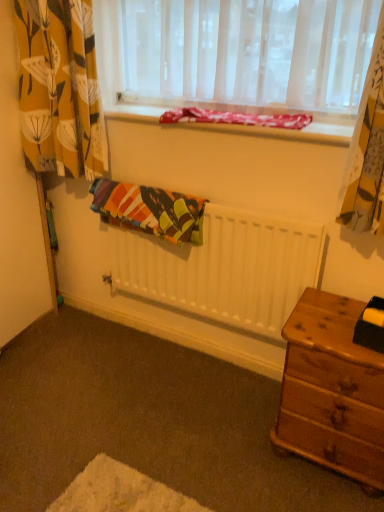
Question: Is wooden nightstand at lower right looking in the opposite direction of white matte radiator at center?

Choices:
 (A) yes
 (B) no

Answer: (B)

Question: Does wooden nightstand at lower right appear on the right side of white matte radiator at center?

Choices:
 (A) no
 (B) yes

Answer: (B)

Question: Is wooden nightstand at lower right smaller than white matte radiator at center?

Choices:
 (A) yes
 (B) no

Answer: (B)

Question: Is the depth of wooden nightstand at lower right less than that of white matte radiator at center?

Choices:
 (A) no
 (B) yes

Answer: (B)

Question: Is white matte radiator at center inside wooden nightstand at lower right?

Choices:
 (A) no
 (B) yes

Answer: (A)

Question: Are wooden nightstand at lower right and white matte radiator at center far apart?

Choices:
 (A) no
 (B) yes

Answer: (A)

Question: From a real-world perspective, is white matte radiator at center on top of wooden nightstand at lower right?

Choices:
 (A) yes
 (B) no

Answer: (A)

Question: Can wooden nightstand at lower right be found inside white matte radiator at center?

Choices:
 (A) no
 (B) yes

Answer: (A)

Question: Is white matte radiator at center in contact with wooden nightstand at lower right?

Choices:
 (A) no
 (B) yes

Answer: (A)

Question: From a real-world perspective, is white matte radiator at center below wooden nightstand at lower right?

Choices:
 (A) yes
 (B) no

Answer: (B)

Question: Is white matte radiator at center not within wooden nightstand at lower right?

Choices:
 (A) yes
 (B) no

Answer: (A)

Question: Considering the relative sizes of white matte radiator at center and wooden nightstand at lower right in the image provided, is white matte radiator at center taller than wooden nightstand at lower right?

Choices:
 (A) yes
 (B) no

Answer: (A)

Question: From a real-world perspective, does multicolored fabric at center sit lower than white matte radiator at center?

Choices:
 (A) yes
 (B) no

Answer: (B)